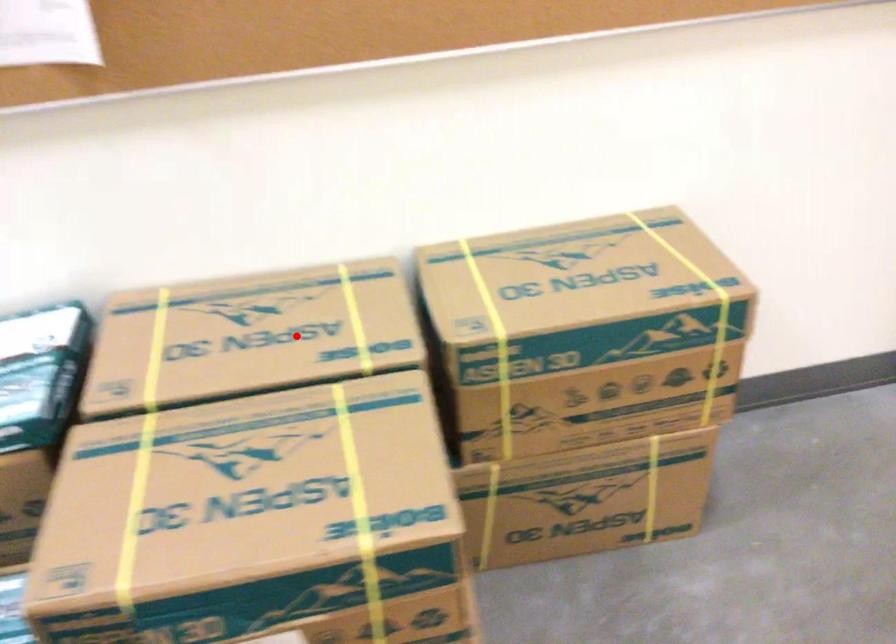
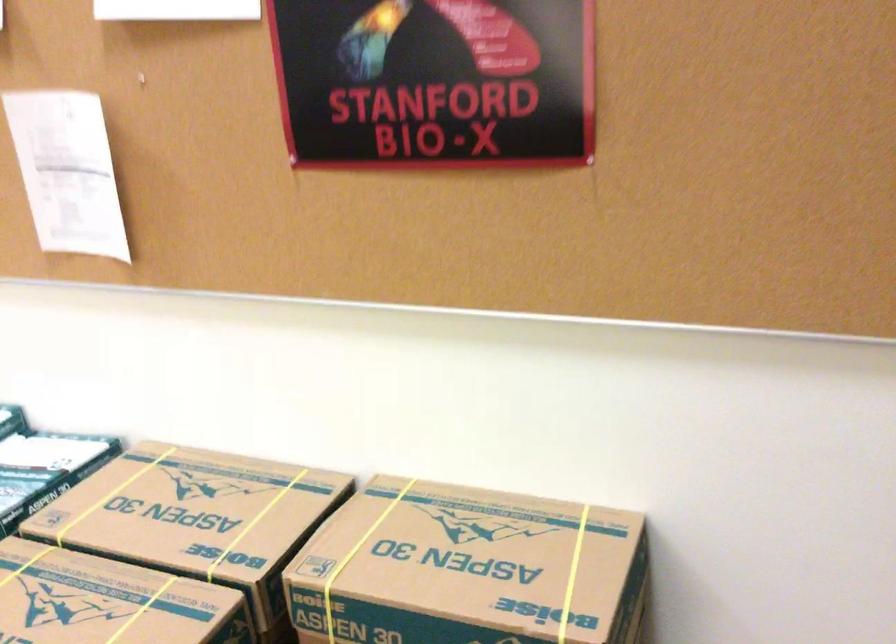
Find the pixel in the second image that matches the highlighted location in the first image.

(197, 518)